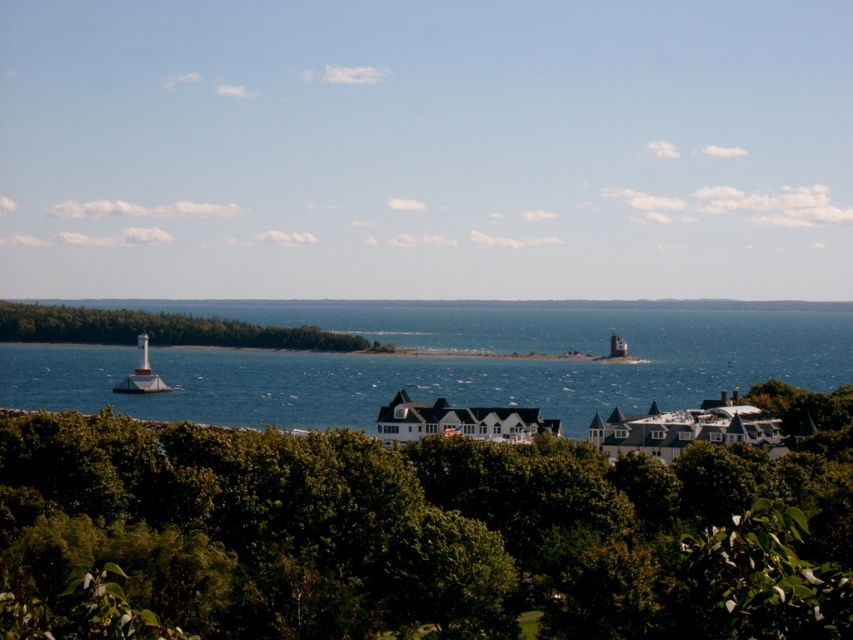
You are standing at the top of the hill and looking down at the green leafy tree at lower center and the green leafy tree at left. Which tree appears closer to you?

The green leafy tree at lower center appears closer because it is positioned in front of the green leafy tree at left.

You are standing at the center of the image and want to walk towards the green leafy tree at lower center. Which direction should you move in?

The green leafy tree at lower center is located at point 0.830 on the x axis and 0.508 on the y axis. Since you are at the center of the image, you should move towards the lower right direction to reach the green leafy tree at lower center.